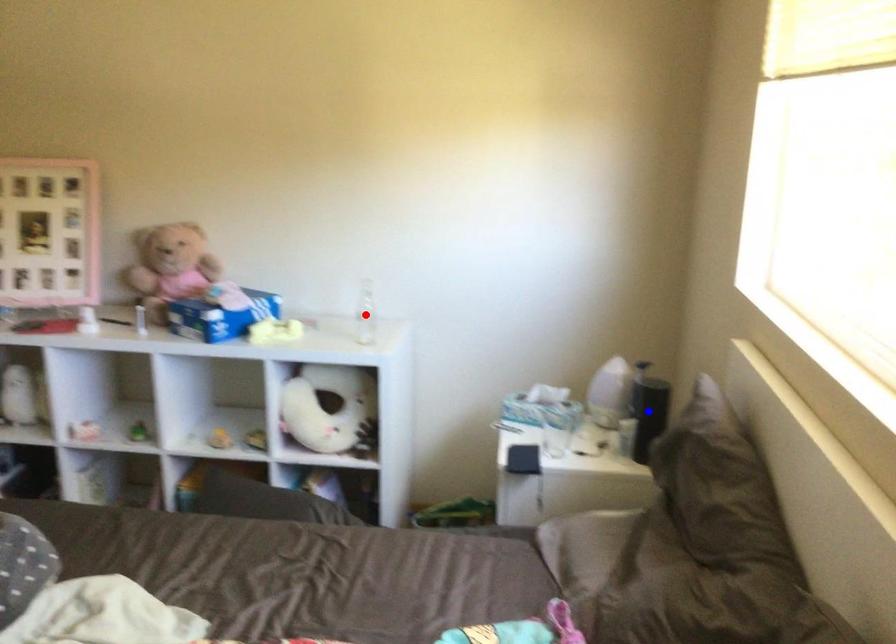
Question: In the image, two points are highlighted. Which point is nearer to the camera? Reply with the corresponding letter.

Choices:
 (A) blue point
 (B) red point

Answer: (A)